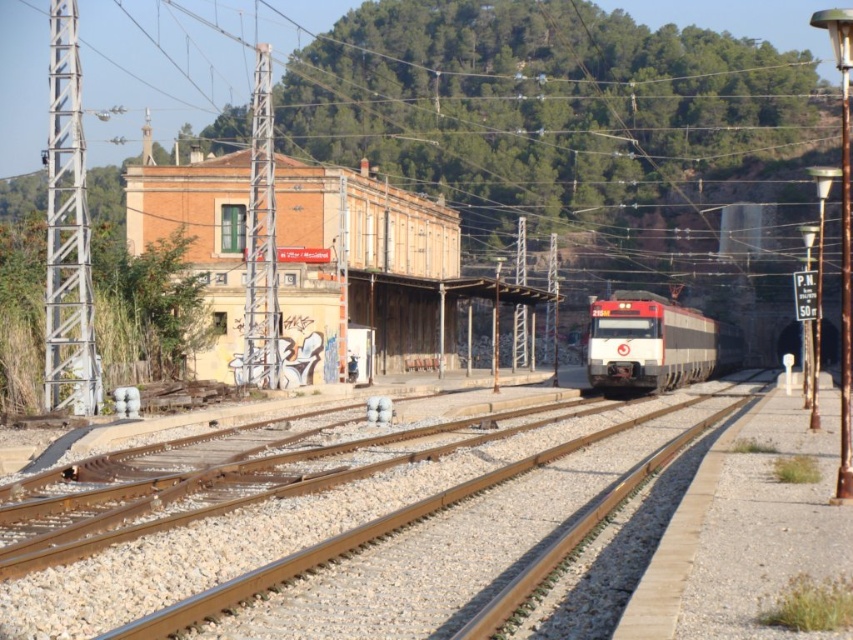
Does brown metallic train track at center appear on the left side of red glossy train at center?

Yes, brown metallic train track at center is to the left of red glossy train at center.

The width and height of the screenshot is (853, 640). What do you see at coordinates (363, 534) in the screenshot?
I see `brown metallic train track at center` at bounding box center [363, 534].

Between point (45, 568) and point (728, 348), which one is positioned in front?

Point (45, 568)

Locate an element on the screen. The width and height of the screenshot is (853, 640). brown metallic train track at center is located at coordinates (363, 534).

How much distance is there between brick building at center and red glossy train at center?

brick building at center and red glossy train at center are 50.77 feet apart.

Is brick building at center closer to the viewer compared to red glossy train at center?

Yes, brick building at center is closer to the viewer.

Is point (323, 211) positioned behind point (606, 376)?

Yes.

This screenshot has width=853, height=640. What are the coordinates of `brick building at center` in the screenshot? It's located at (370, 264).

Which of these two, brown metallic train track at center or brick building at center, stands shorter?

Standing shorter between the two is brown metallic train track at center.

Is brown metallic train track at center bigger than brick building at center?

Incorrect, brown metallic train track at center is not larger than brick building at center.

Does point (544, 438) come in front of point (422, 300)?

Yes, point (544, 438) is closer to viewer.

Identify the location of brown metallic train track at center. (363, 534).